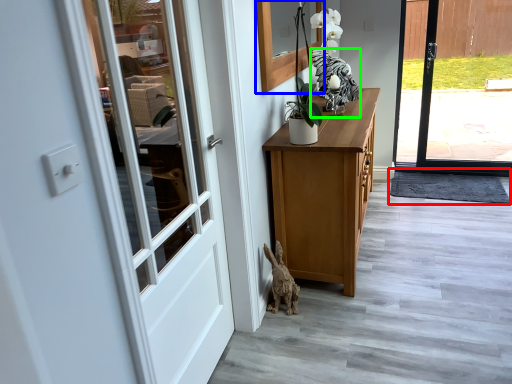
Question: Which object is positioned farthest from doormat (highlighted by a red box)? Select from window (highlighted by a blue box) and animal (highlighted by a green box).

Choices:
 (A) window
 (B) animal

Answer: (A)